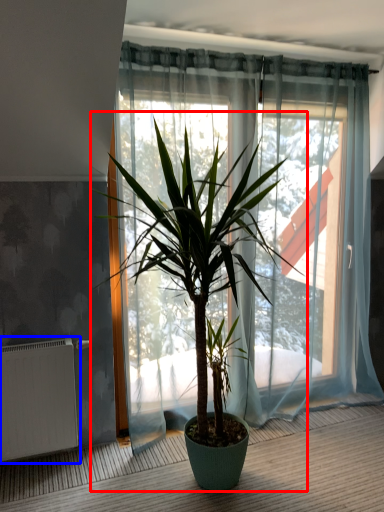
Question: Which object is further to the camera taking this photo, houseplant (highlighted by a red box) or radiator (highlighted by a blue box)?

Choices:
 (A) houseplant
 (B) radiator

Answer: (B)